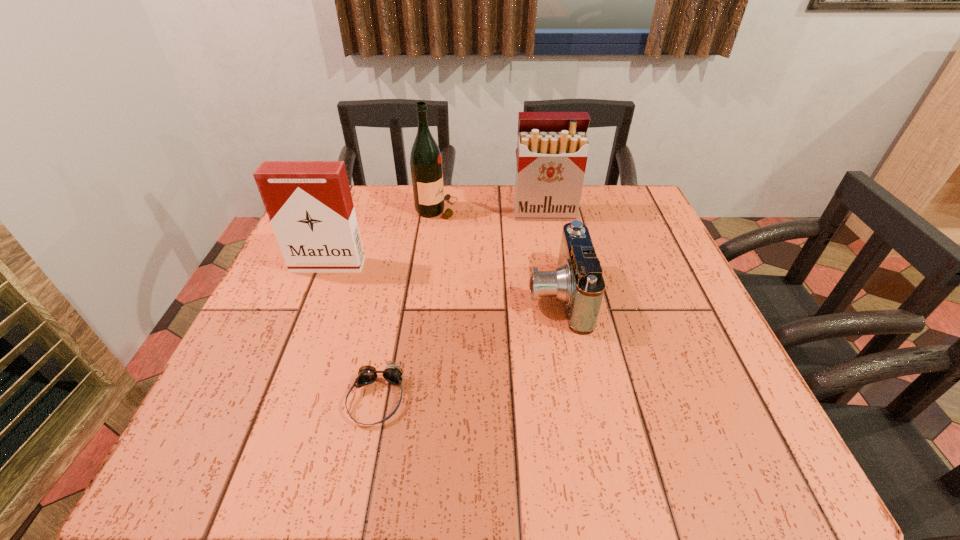
Find the location of a particular element. The height and width of the screenshot is (540, 960). vacant region at the right edge of the desktop is located at coordinates (719, 353).

This screenshot has height=540, width=960. Find the location of `vacant space at the far left corner`. vacant space at the far left corner is located at coordinates (365, 199).

The height and width of the screenshot is (540, 960). Find the location of `vacant space at the far right corner of the desktop`. vacant space at the far right corner of the desktop is located at coordinates (594, 209).

Find the location of a particular element. This screenshot has width=960, height=540. vacant space in between the leftmost object and the wine bottle is located at coordinates (382, 237).

The width and height of the screenshot is (960, 540). In order to click on vacant region between the right cigarette_case and the wine bottle in this screenshot , I will do `click(491, 211)`.

What are the coordinates of `empty location between the right cigarette_case and the wine bottle` in the screenshot? It's located at (491, 211).

You are a GUI agent. You are given a task and a screenshot of the screen. Output one action in this format:
    pyautogui.click(x=<x>, y=<y>)
    Task: Click on the free space between the shortest object and the right cigarette_case
    
    Given the screenshot: What is the action you would take?
    461,306

In order to click on blank region between the nearer cigarette_case and the camcorder in this screenshot , I will do `click(443, 280)`.

You are a GUI agent. You are given a task and a screenshot of the screen. Output one action in this format:
    pyautogui.click(x=<x>, y=<y>)
    Task: Click on the vacant space in between the farther cigarette_case and the wine bottle
    This screenshot has width=960, height=540.
    Given the screenshot: What is the action you would take?
    pyautogui.click(x=491, y=211)

What are the coordinates of `free space that is in between the shortest object and the fourth tallest object` in the screenshot? It's located at (467, 347).